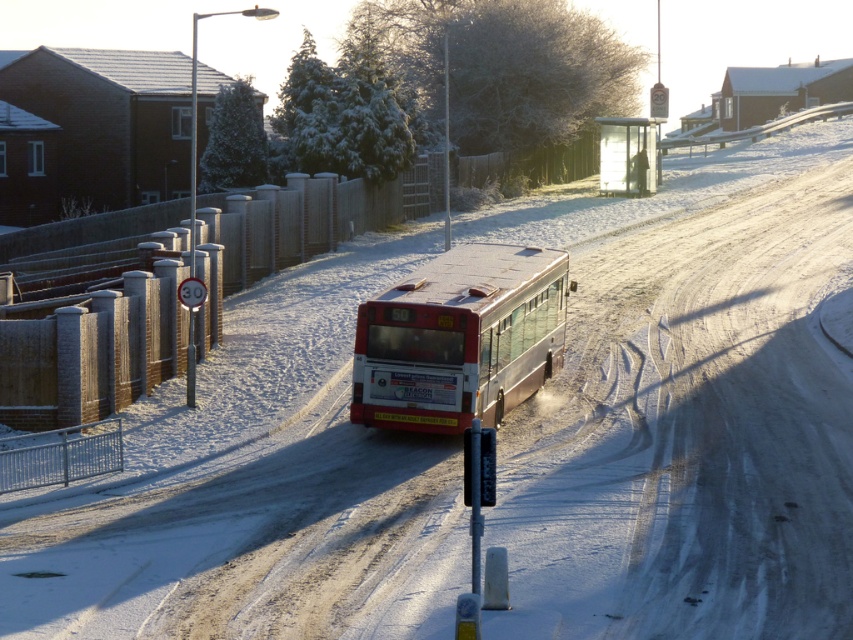
Question: Is silver metallic bus at center positioned in front of transparent plastic bus stop at center?

Choices:
 (A) yes
 (B) no

Answer: (A)

Question: Which point appears closest to the camera in this image?

Choices:
 (A) (618, 179)
 (B) (434, 300)

Answer: (B)

Question: Is silver metallic bus at center wider than transparent plastic bus stop at center?

Choices:
 (A) yes
 (B) no

Answer: (B)

Question: Is silver metallic bus at center positioned at the back of transparent plastic bus stop at center?

Choices:
 (A) no
 (B) yes

Answer: (A)